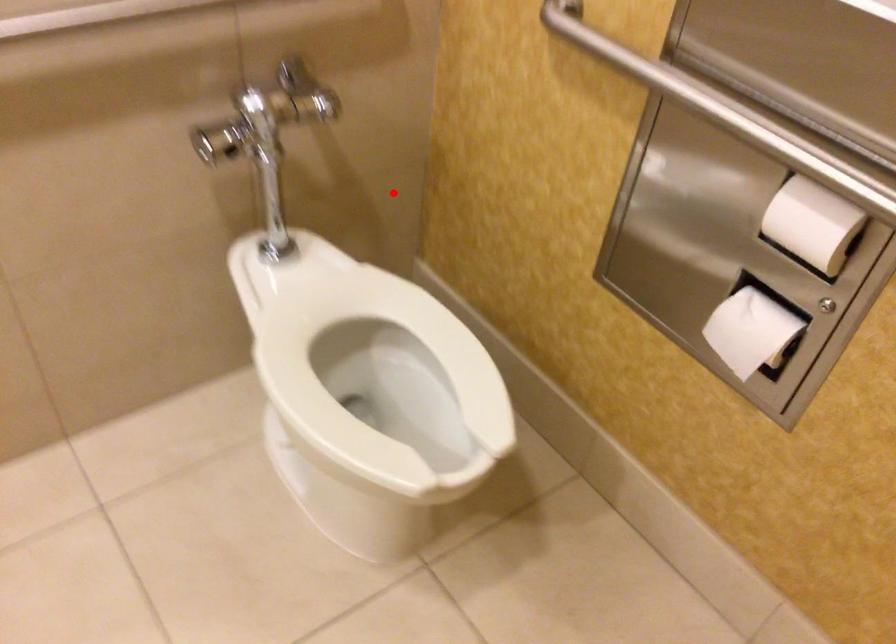
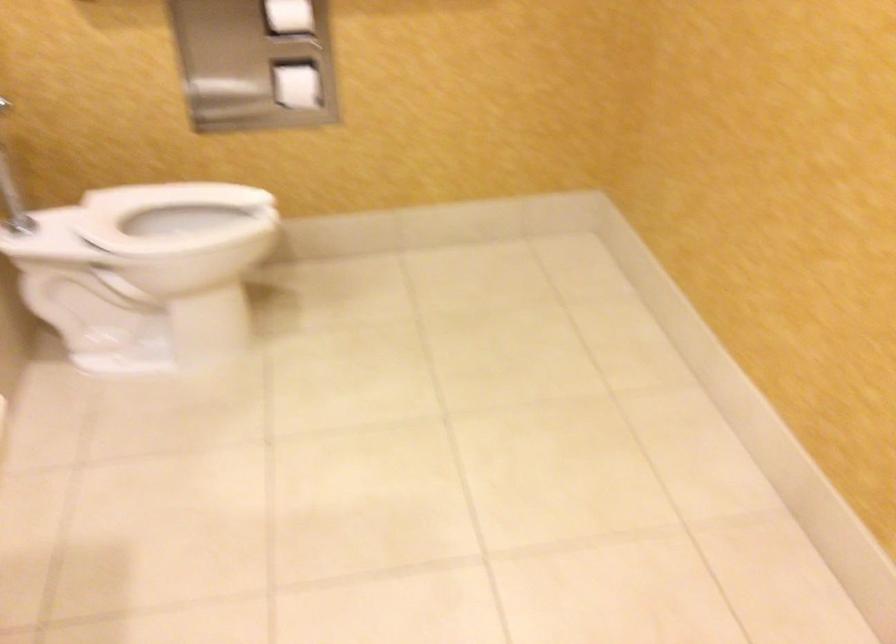
Question: I am providing you with two images of the same scene from different viewpoints. Image1 has a red point marked. In image2, the corresponding 3D location appears at what relative position? Reply with the corresponding letter.

Choices:
 (A) Closer
 (B) Farther

Answer: (B)